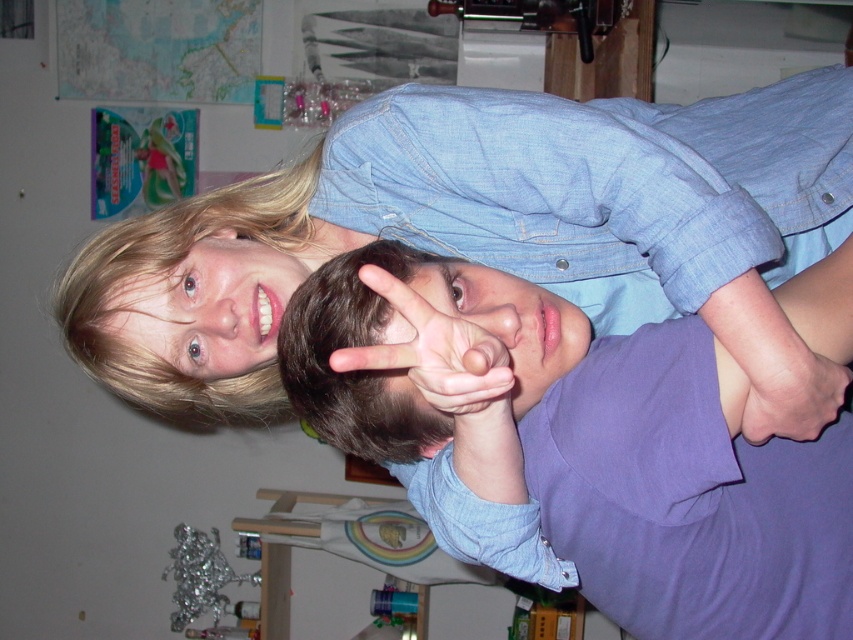
You are designing a new clothing line and want to create a matching outfit using both the blue denim shirt at upper center and the purple cotton shirt at center. Since you need to know which shirt is wider to ensure proper layering, can you determine which one is wider?

The blue denim shirt at upper center is wider than the purple cotton shirt at center, so it should be layered over the top to maintain the desired look.